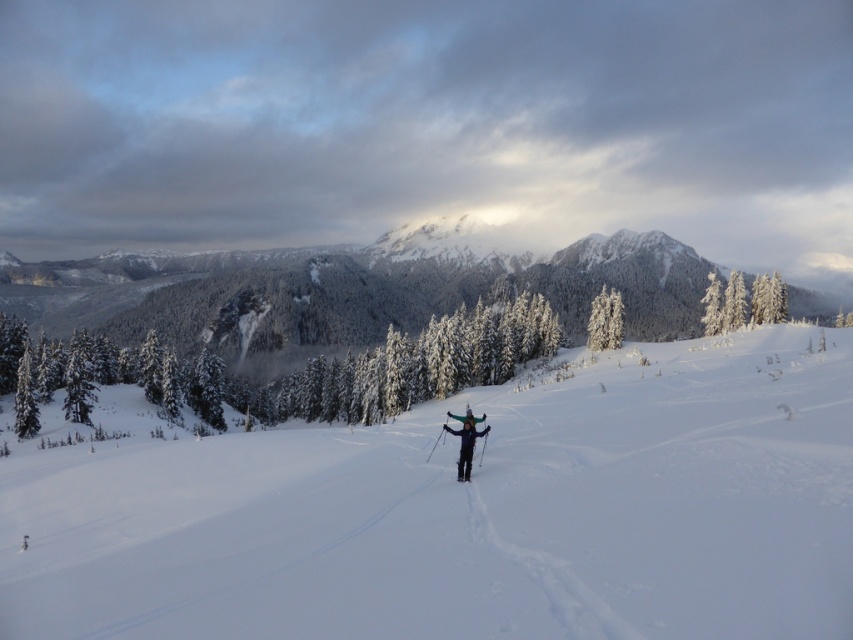
Question: Which point is closer to the camera?

Choices:
 (A) (190, 552)
 (B) (465, 476)

Answer: (A)

Question: Is white snow ski slope at center below dark blue ski suit at center?

Choices:
 (A) yes
 (B) no

Answer: (A)

Question: Which point appears closest to the camera in this image?

Choices:
 (A) (49, 314)
 (B) (189, 564)

Answer: (B)

Question: Can you confirm if snowy pine trees at center is positioned above white frosty tree at upper right?

Choices:
 (A) yes
 (B) no

Answer: (A)

Question: Can you confirm if dark blue ski suit at center is thinner than black matte ski at center?

Choices:
 (A) no
 (B) yes

Answer: (A)

Question: Based on their relative distances, which object is nearer to the snowy pine trees at center?

Choices:
 (A) white frosty tree at upper center
 (B) white frosty tree at upper right
 (C) snow-covered evergreen tree at left

Answer: (B)